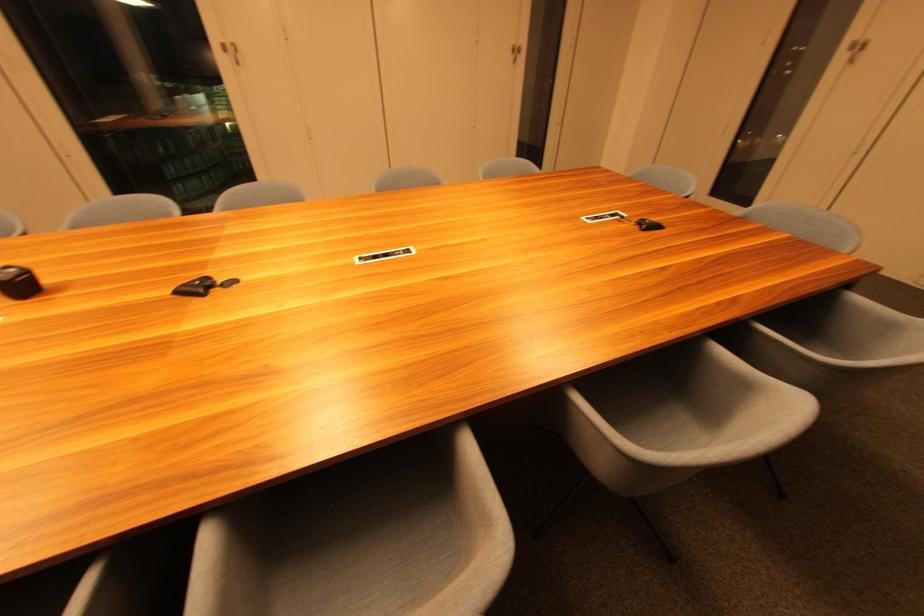
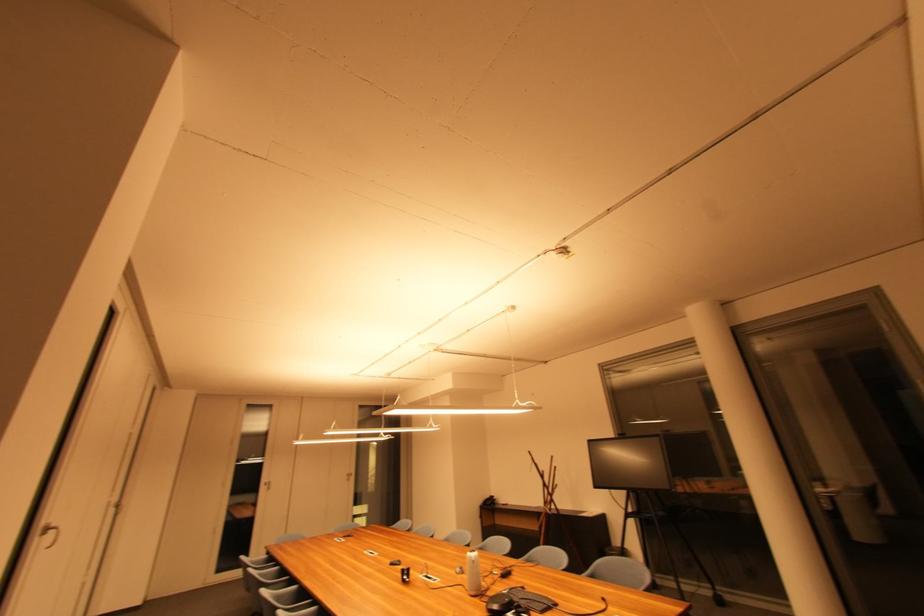
Where in the second image is the point corresponding to pixel 857 47 from the first image?

(271, 485)